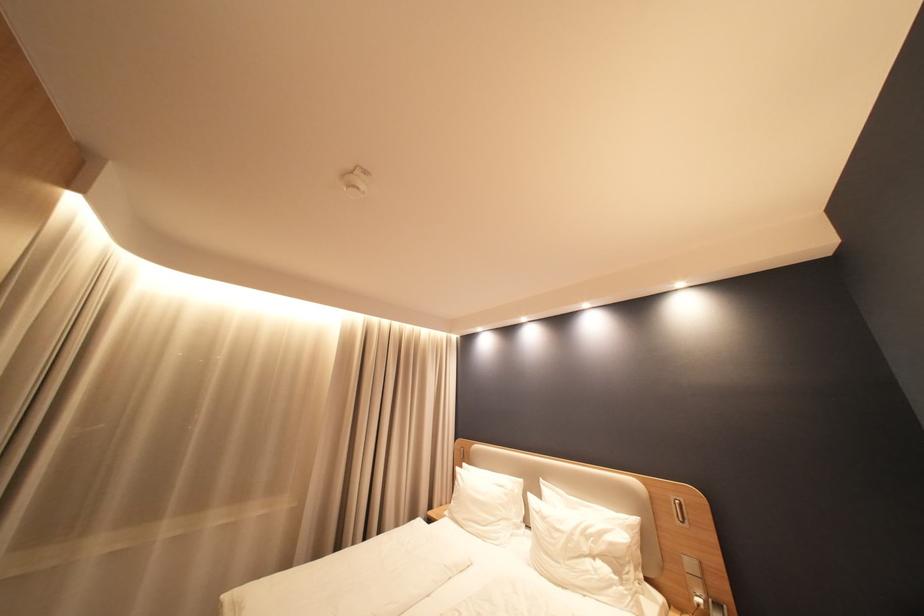
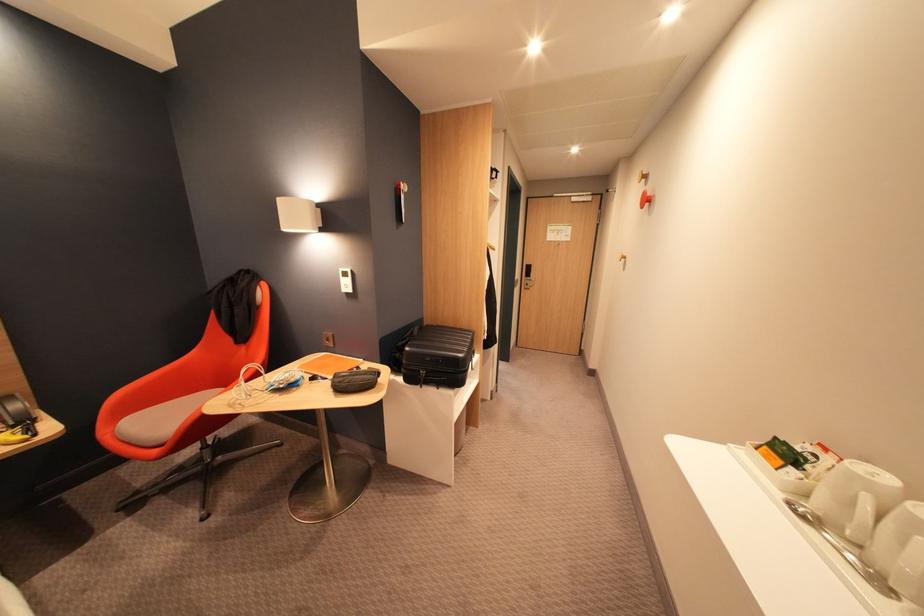
Question: Based on the continuous images, in which direction is the camera rotating? Reply with the corresponding letter.

Choices:
 (A) Left
 (B) Right
 (C) Up
 (D) Down

Answer: (B)